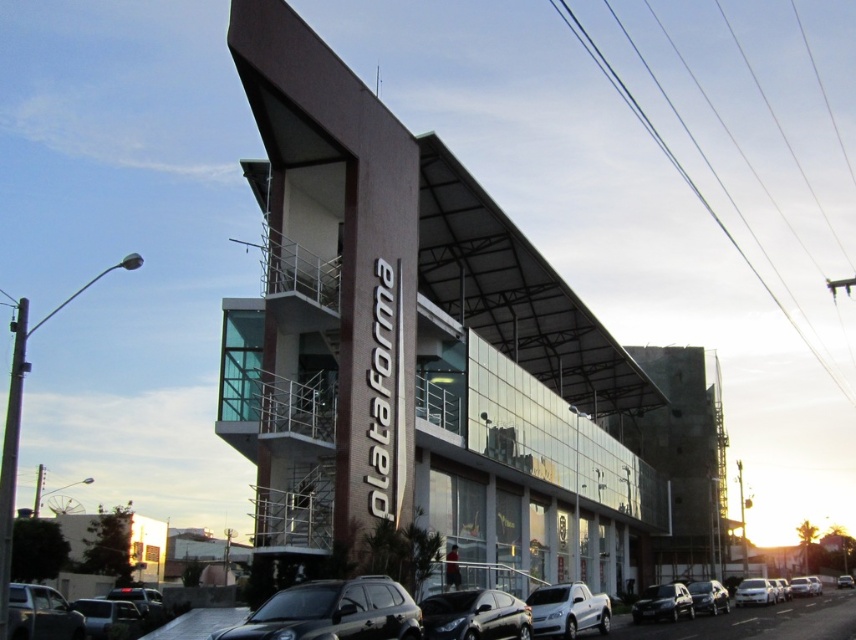
Question: Which point is closer to the camera?

Choices:
 (A) (691, 589)
 (B) (565, 625)

Answer: (B)

Question: Considering the relative positions of shiny black car at lower left and satin silver sedan at lower right in the image provided, where is shiny black car at lower left located with respect to satin silver sedan at lower right?

Choices:
 (A) above
 (B) below

Answer: (A)

Question: Does shiny black sedan at lower center have a greater width compared to shiny black car at lower left?

Choices:
 (A) yes
 (B) no

Answer: (B)

Question: Which of these objects is positioned closest to the satin black car at lower right?

Choices:
 (A) shiny black sedan at lower center
 (B) satin silver sedan at lower right
 (C) satin black car at lower center
 (D) shiny black car at lower left

Answer: (A)

Question: Is white glossy pickup truck at lower center thinner than matte black car at lower left?

Choices:
 (A) yes
 (B) no

Answer: (B)

Question: Which point is farther from the camera taking this photo?

Choices:
 (A) (691, 588)
 (B) (108, 596)

Answer: (B)